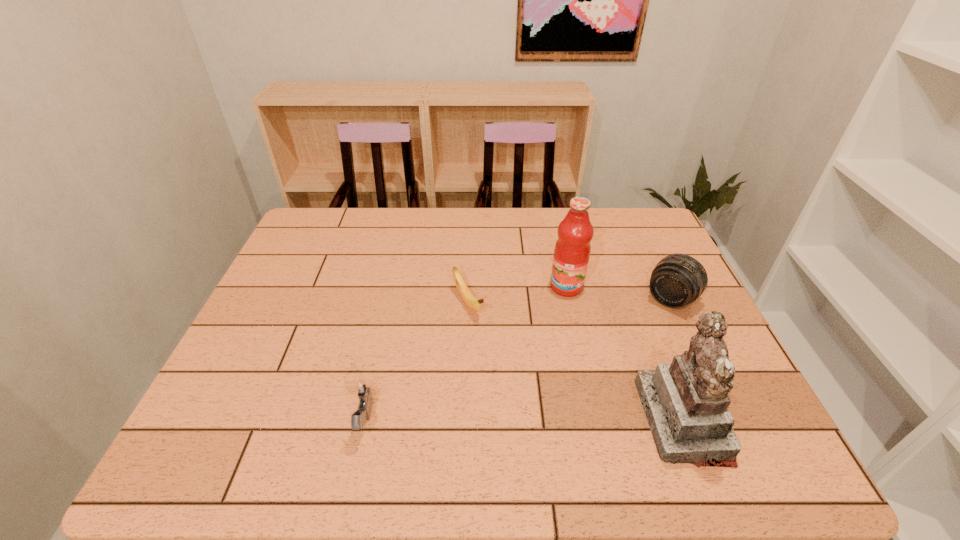
Find the location of a particular element. igniter located in the near edge section of the desktop is located at coordinates (364, 389).

The image size is (960, 540). In order to click on figurine that is positioned at the near edge in this screenshot , I will do `click(686, 402)`.

I want to click on figurine that is at the right edge, so click(x=686, y=402).

You are a GUI agent. You are given a task and a screenshot of the screen. Output one action in this format:
    pyautogui.click(x=<x>, y=<y>)
    Task: Click on the telephoto lens that is at the right edge
    The width and height of the screenshot is (960, 540).
    Given the screenshot: What is the action you would take?
    pyautogui.click(x=677, y=280)

Locate an element on the screen. object at the near right corner is located at coordinates (686, 402).

You are a GUI agent. You are given a task and a screenshot of the screen. Output one action in this format:
    pyautogui.click(x=<x>, y=<y>)
    Task: Click on the vacant region at the far edge of the desktop
    
    Given the screenshot: What is the action you would take?
    pyautogui.click(x=515, y=232)

This screenshot has height=540, width=960. What are the coordinates of `vacant point at the near edge` in the screenshot? It's located at (526, 408).

In the image, there is a desktop. Where is `free space at the left edge`? Image resolution: width=960 pixels, height=540 pixels. free space at the left edge is located at coordinates pyautogui.click(x=257, y=383).

This screenshot has height=540, width=960. In the image, there is a desktop. Identify the location of vacant space at the right edge. (644, 251).

Image resolution: width=960 pixels, height=540 pixels. I want to click on vacant region at the far left corner, so click(354, 217).